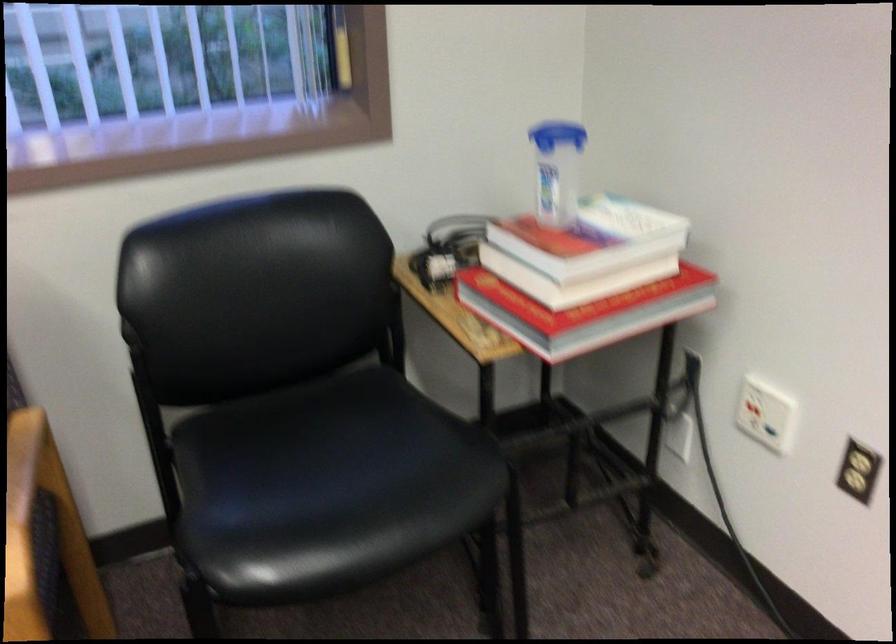
Image resolution: width=896 pixels, height=644 pixels. Find the location of `red book`. red book is located at coordinates (580, 297).